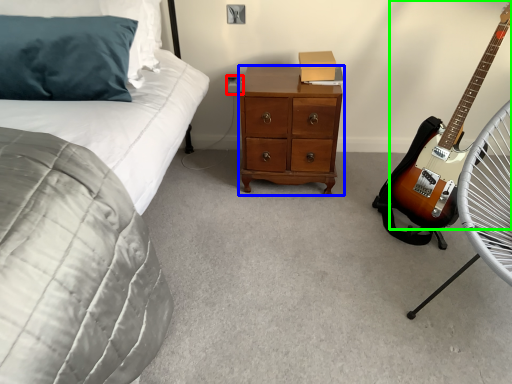
Question: Estimate the real-world distances between objects in this image. Which object is farther from electric outlet (highlighted by a red box), chest of drawers (highlighted by a blue box) or guitar (highlighted by a green box)?

Choices:
 (A) chest of drawers
 (B) guitar

Answer: (B)